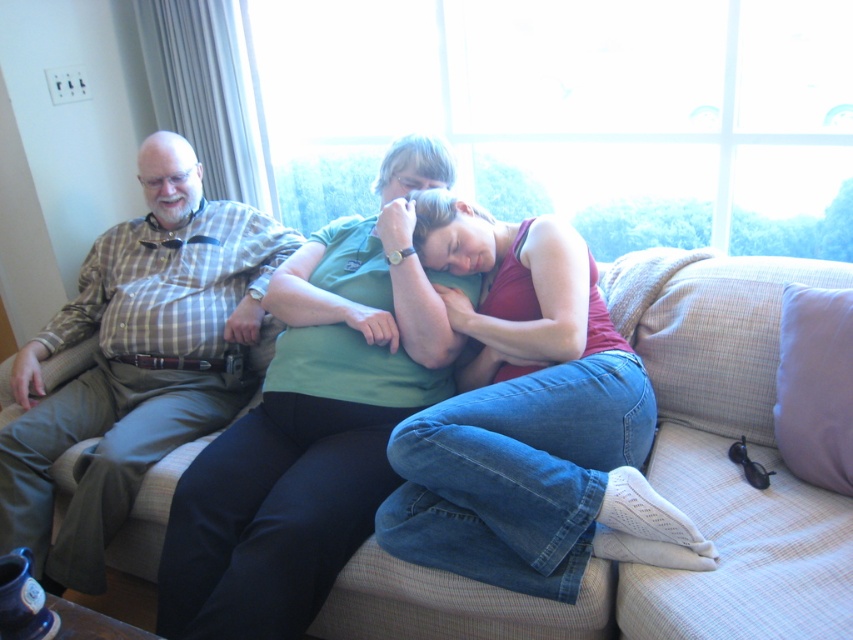
From the picture: Does beige fabric couch at center have a lesser width compared to plaid shirt at left?

No, beige fabric couch at center is not thinner than plaid shirt at left.

Can you confirm if beige fabric couch at center is bigger than plaid shirt at left?

Yes, beige fabric couch at center is bigger than plaid shirt at left.

Is point (647, 324) positioned after point (177, 429)?

No, it is in front of (177, 429).

Where is `beige fabric couch at center`? beige fabric couch at center is located at coordinates (723, 440).

Is point (91, 337) behind point (509, 273)?

Yes, point (91, 337) is farther from viewer.

Can you confirm if beige fabric couch at center is shorter than matte green tank top at center?

Incorrect, beige fabric couch at center's height does not fall short of matte green tank top at center's.

This screenshot has height=640, width=853. I want to click on beige fabric couch at center, so click(x=723, y=440).

Can you confirm if matte green tank top at center is shorter than plaid shirt at left?

Yes, matte green tank top at center is shorter than plaid shirt at left.

Does point (451, 260) come closer to viewer compared to point (152, 144)?

Yes, it is in front of point (152, 144).

Locate an element on the screen. matte green tank top at center is located at coordinates (527, 422).